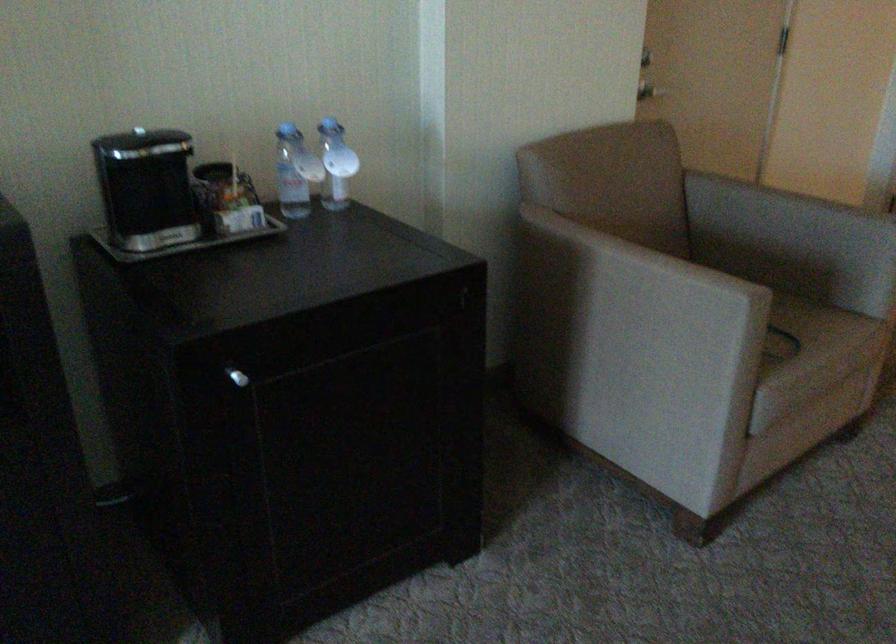
Find where to lift the black lid knob. Please return your answer as a coordinate pair (x, y).

(212, 171)